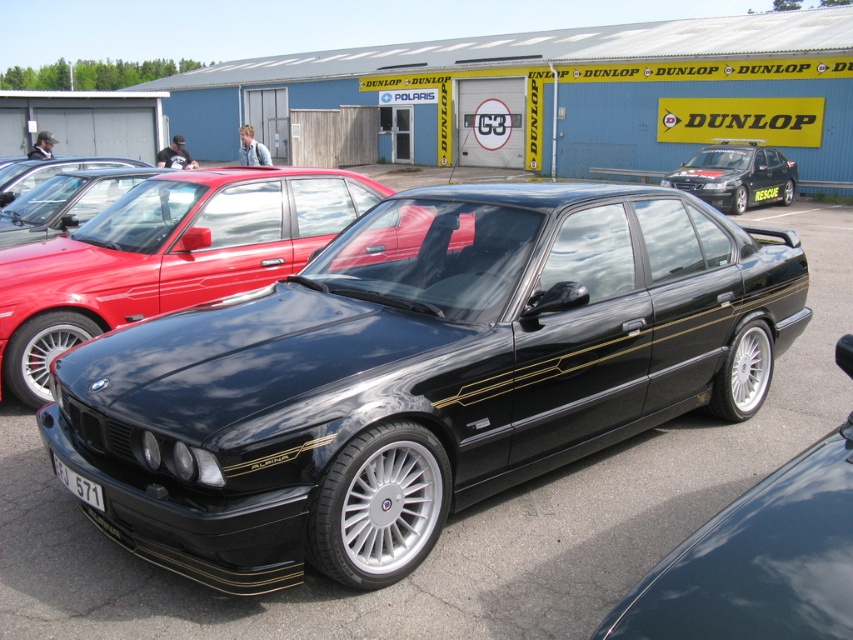
Consider the image. Is glossy black car at center further to camera compared to black metallic car at center?

Yes.

This screenshot has width=853, height=640. What do you see at coordinates (418, 374) in the screenshot?
I see `glossy black car at center` at bounding box center [418, 374].

Locate an element on the screen. This screenshot has height=640, width=853. glossy black car at center is located at coordinates (418, 374).

Between shiny black sedan at center and matte black car at upper left, which one has less height?

Standing shorter between the two is shiny black sedan at center.

Does shiny black sedan at center appear on the left side of matte black car at upper left?

In fact, shiny black sedan at center is to the right of matte black car at upper left.

Which is in front, point (202, 234) or point (107, 163)?

Point (202, 234) is in front.

I want to click on shiny black sedan at center, so click(165, 257).

Between matte black car at upper left and white plastic license plate at center, which one is positioned higher?

Positioned higher is matte black car at upper left.

Can you confirm if matte black car at upper left is bigger than white plastic license plate at center?

Yes.

Which is in front, point (19, 173) or point (762, 192)?

Positioned in front is point (19, 173).

The image size is (853, 640). What are the coordinates of `matte black car at upper left` in the screenshot? It's located at (49, 179).